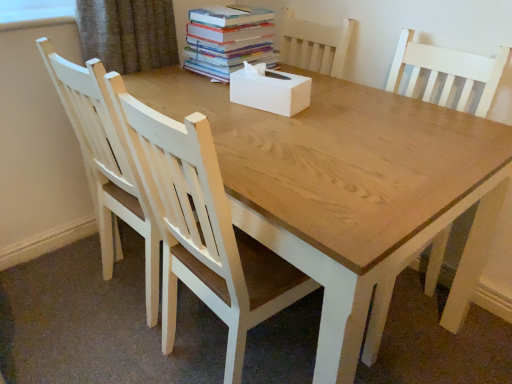
Question: Is white wood chair at left, which ranks as the second chair in right-to-left order, inside the boundaries of white matte tissue box at center, or outside?

Choices:
 (A) inside
 (B) outside

Answer: (B)

Question: Is white wood chair at left, which ranks as the second chair in right-to-left order, bigger or smaller than white matte tissue box at center?

Choices:
 (A) big
 (B) small

Answer: (A)

Question: Which object is the farthest from the white matte tissue box at center?

Choices:
 (A) white wood chair at center, which is the first chair from right to left
 (B) hardcover books at upper center
 (C) white wood chair at left, which is the 1th chair from left to right

Answer: (C)

Question: Which object is the closest to the white matte tissue box at center?

Choices:
 (A) hardcover books at upper center
 (B) white wood chair at left, which ranks as the second chair in right-to-left order
 (C) white wood chair at center, which is the first chair from right to left

Answer: (A)